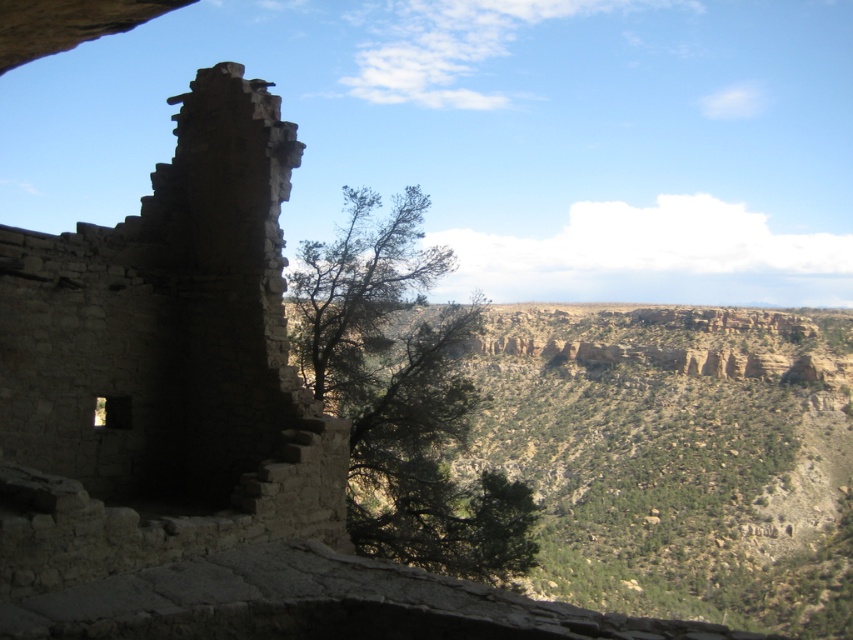
You are standing in front of the rustic stone ruins at left and the green leafy tree at center. Which object is taller?

The green leafy tree at center is taller than the rustic stone ruins at left.

You are standing in a desert landscape and see the rustic stone ruins at left and the green leafy tree at center. Which object is positioned further to the east?

The rustic stone ruins at left is to the left of green leafy tree at center, so the rustic stone ruins at left is positioned further to the east.

You are standing at the camera position and want to take a photo of the rustic stone ruins at left. If your camera has a maximum focus distance of 25 meters, will it be able to capture the ruins clearly?

The rustic stone ruins at left are 25.83 meters away from the camera. Since the maximum focus distance is 25 meters, the camera cannot capture the ruins clearly as they are slightly beyond the focus range.